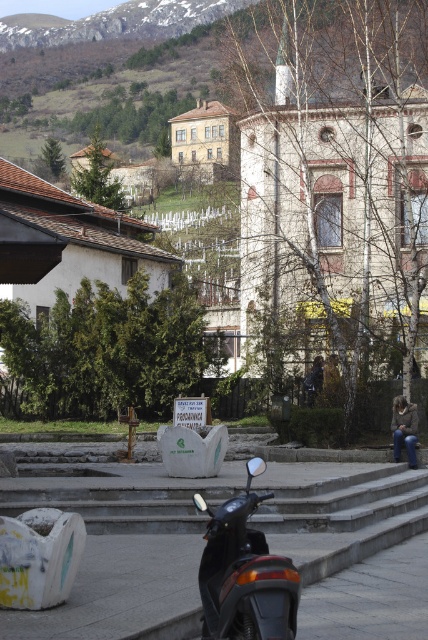
Question: Which object is farther from the camera taking this photo?

Choices:
 (A) brown leather jacket at lower right
 (B) black matte scooter at lower center

Answer: (A)

Question: Can you confirm if black matte scooter at lower center is thinner than brown leather jacket at lower right?

Choices:
 (A) no
 (B) yes

Answer: (B)

Question: Is the position of black matte scooter at lower center more distant than that of brown leather jacket at lower right?

Choices:
 (A) yes
 (B) no

Answer: (B)

Question: Which object appears farthest from the camera in this image?

Choices:
 (A) brown leather jacket at lower right
 (B) black matte scooter at lower center

Answer: (A)

Question: Which point is closer to the camera?

Choices:
 (A) (398, 438)
 (B) (220, 577)

Answer: (B)

Question: Is black matte scooter at lower center to the right of brown leather jacket at lower right from the viewer's perspective?

Choices:
 (A) no
 (B) yes

Answer: (A)